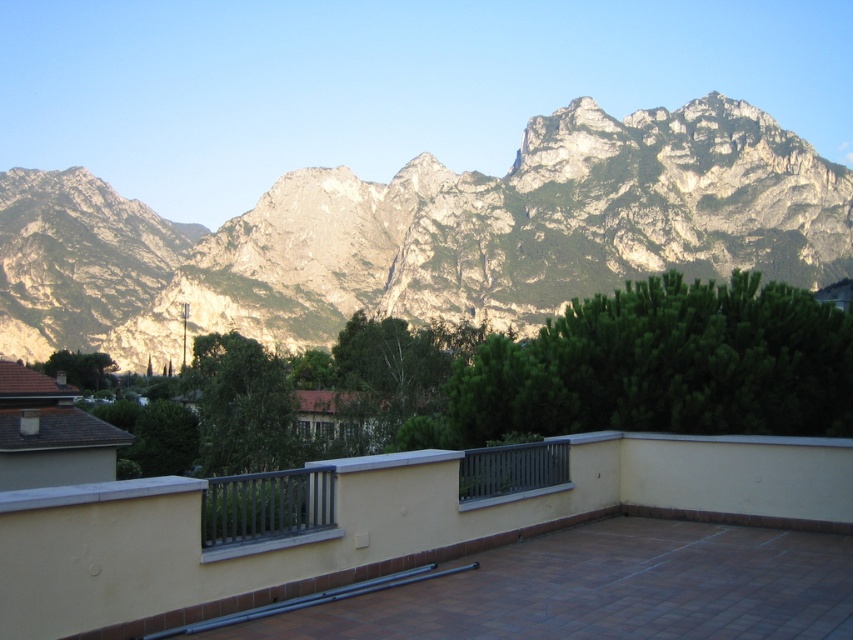
Question: Which object is positioned farthest from the matte gray balcony at center?

Choices:
 (A) metallic gray rail at center
 (B) rocky gray mountain range at upper center

Answer: (B)

Question: Can you confirm if matte gray balcony at center is smaller than metallic gray rail at center?

Choices:
 (A) yes
 (B) no

Answer: (B)

Question: Is rocky gray mountain range at upper center to the right of matte gray balcony at center from the viewer's perspective?

Choices:
 (A) yes
 (B) no

Answer: (B)

Question: Which point is farther to the camera?

Choices:
 (A) (83, 532)
 (B) (256, 310)

Answer: (B)

Question: Which point appears farthest from the camera in this image?

Choices:
 (A) (273, 605)
 (B) (281, 221)
 (C) (38, 595)

Answer: (B)

Question: Can you confirm if rocky gray mountain range at upper center is positioned below metallic gray rail at center?

Choices:
 (A) yes
 (B) no

Answer: (B)